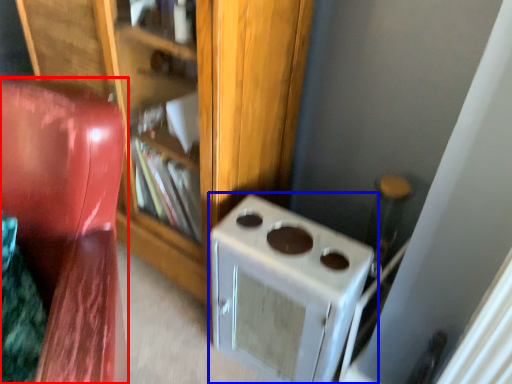
Question: Which object is further to the camera taking this photo, furniture (highlighted by a red box) or home appliance (highlighted by a blue box)?

Choices:
 (A) furniture
 (B) home appliance

Answer: (B)